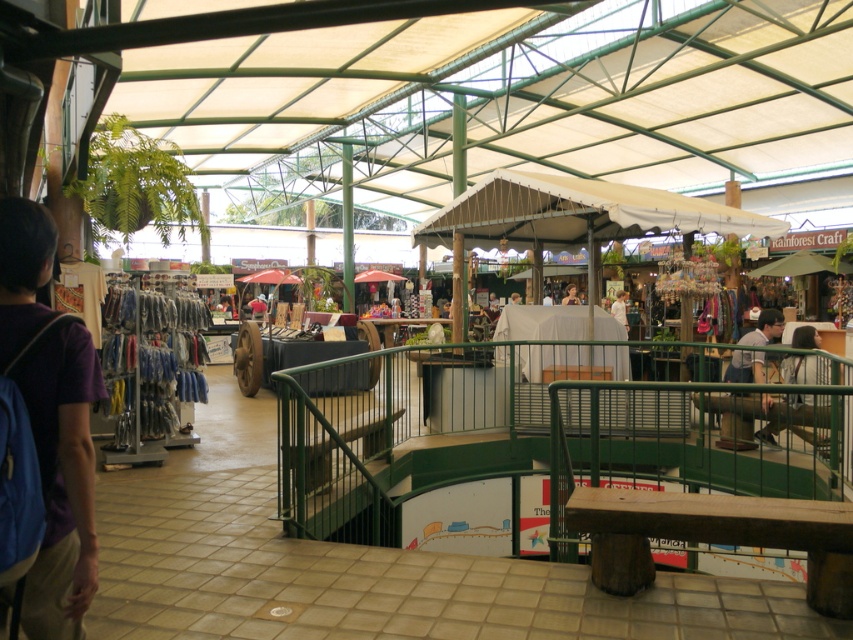
You are a customer in the market and want to pick up the gray fabric shirt at upper right and the light brown wooden chair at center. Which item is physically nearer to you as you stand in the market?

The gray fabric shirt at upper right is closer to the viewer than the light brown wooden chair at center, so the gray fabric shirt at upper right is physically nearer to you.

You are a customer in the market and want to buy both the gray fabric shirt at upper right and the dark brown leather jacket at lower right. Which item should you approach first if you want to minimize the distance walked?

You should approach the gray fabric shirt at upper right first because it is located to the left of the dark brown leather jacket at lower right, meaning they are positioned side by side horizontally. By starting with the shirt on the left, you can then move to the jacket on the right without backtracking.